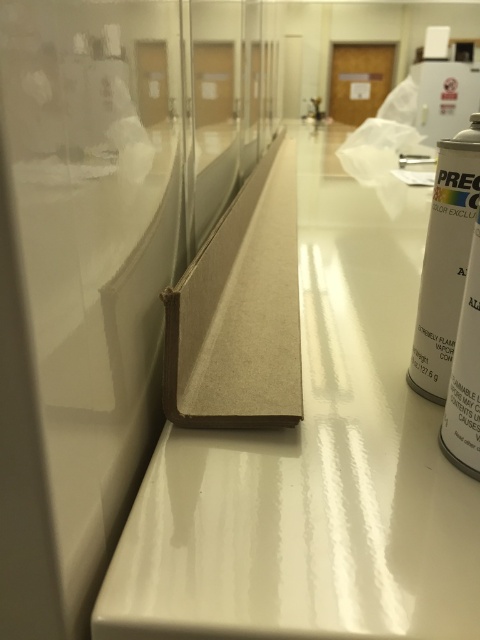
Question: Is brown cardboard at center to the left of matte silver spray can at right from the viewer's perspective?

Choices:
 (A) yes
 (B) no

Answer: (B)

Question: Among these points, which one is nearest to the camera?

Choices:
 (A) [444, 413]
 (B) [333, 611]
 (C) [456, 257]

Answer: (B)

Question: Which point is closer to the camera taking this photo?

Choices:
 (A) (358, 358)
 (B) (445, 420)

Answer: (B)

Question: Does brown cardboard at center appear over matte silver spray can at right?

Choices:
 (A) no
 (B) yes

Answer: (B)

Question: Can you confirm if brown cardboard at center is positioned above matte silver spray can at right?

Choices:
 (A) no
 (B) yes

Answer: (B)

Question: Estimate the real-world distances between objects in this image. Which object is farther from the brown cardboard at center?

Choices:
 (A) matte silver spray can at right
 (B) white matte spray can at right

Answer: (A)